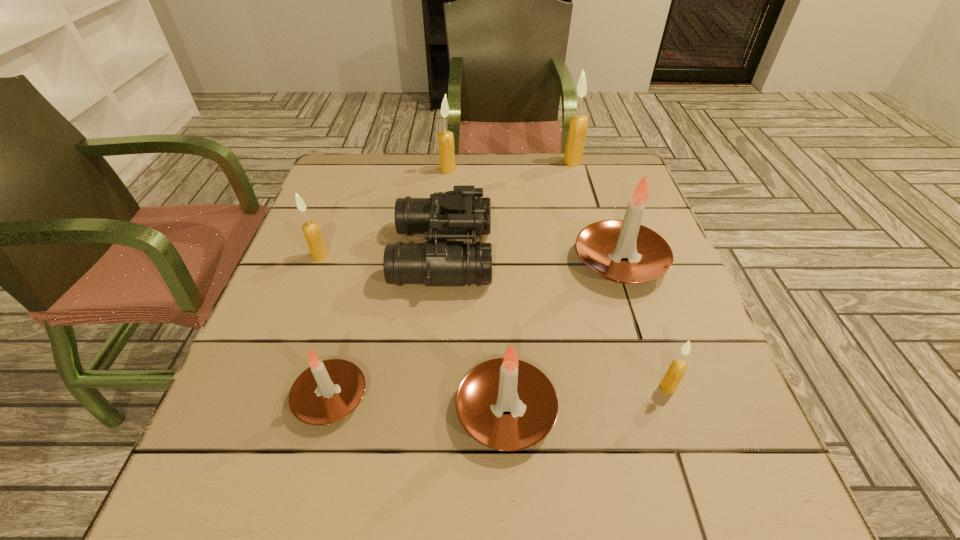
The height and width of the screenshot is (540, 960). What are the coordinates of `the tallest candle` in the screenshot? It's located at (578, 124).

This screenshot has height=540, width=960. Find the location of `the tallest object`. the tallest object is located at coordinates (578, 124).

Find the location of a particular element. This screenshot has height=540, width=960. the rightmost white candle is located at coordinates click(x=601, y=245).

You are a GUI agent. You are given a task and a screenshot of the screen. Output one action in this format:
    pyautogui.click(x=<x>, y=<y>)
    Task: Click on the farthest white candle
    The height and width of the screenshot is (540, 960).
    Given the screenshot: What is the action you would take?
    pyautogui.click(x=601, y=245)

Find the location of a particular element. The image size is (960, 540). the third cream candle from right to left is located at coordinates (445, 138).

This screenshot has width=960, height=540. I want to click on the fifth candle from right to left, so click(445, 138).

Locate an element on the screen. This screenshot has height=540, width=960. the third biggest cream candle is located at coordinates (311, 231).

You are a GUI agent. You are given a task and a screenshot of the screen. Output one action in this format:
    pyautogui.click(x=<x>, y=<y>)
    Task: Click on the leftmost object
    The image size is (960, 540).
    Given the screenshot: What is the action you would take?
    pyautogui.click(x=311, y=231)

Identify the location of the second white candle from left to right. (504, 384).

What are the coordinates of `the second smallest white candle` in the screenshot? It's located at (504, 384).